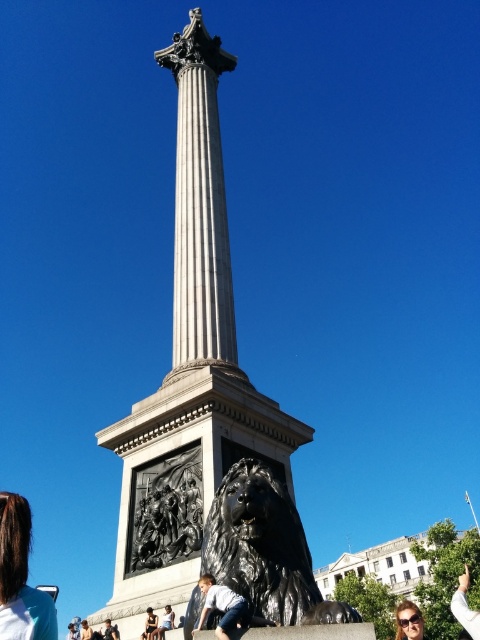
Is point (300, 531) closer to camera compared to point (152, 628)?

Yes, it is in front of point (152, 628).

Between polished bronze lion at center and dark blue jeans at lower center, which one is positioned higher?

Positioned higher is polished bronze lion at center.

Image resolution: width=480 pixels, height=640 pixels. What are the coordinates of `polished bronze lion at center` in the screenshot? It's located at (260, 544).

Between matte black sunglasses at lower right and white fabric shirt at lower center, which one has more height?

matte black sunglasses at lower right is taller.

Can you confirm if matte black sunglasses at lower right is bigger than white fabric shirt at lower center?

Yes, matte black sunglasses at lower right is bigger than white fabric shirt at lower center.

The width and height of the screenshot is (480, 640). In order to click on matte black sunglasses at lower right in this screenshot , I will do `click(408, 621)`.

The width and height of the screenshot is (480, 640). Identify the location of matte black sunglasses at lower right. (408, 621).

From the picture: Is polished bronze lion at center thinner than white fabric shirt at lower center?

In fact, polished bronze lion at center might be wider than white fabric shirt at lower center.

Is polished bronze lion at center positioned in front of white fabric shirt at lower center?

Yes, it is in front of white fabric shirt at lower center.

Who is more forward, (204, 570) or (170, 614)?

Positioned in front is point (204, 570).

This screenshot has width=480, height=640. In order to click on polished bronze lion at center in this screenshot , I will do [x=260, y=544].